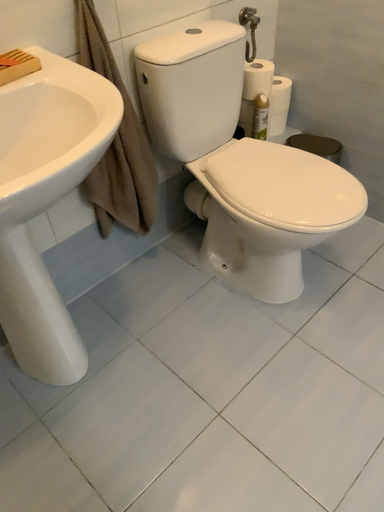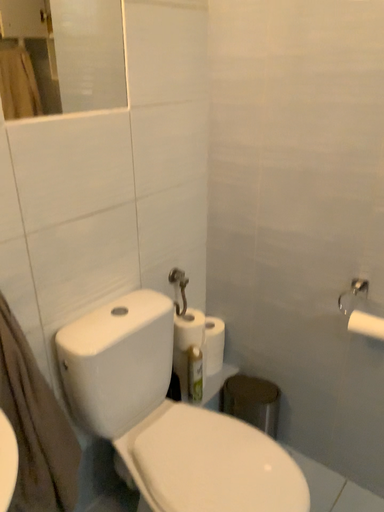
Question: Which way did the camera rotate in the video?

Choices:
 (A) rotated upward
 (B) rotated downward

Answer: (A)